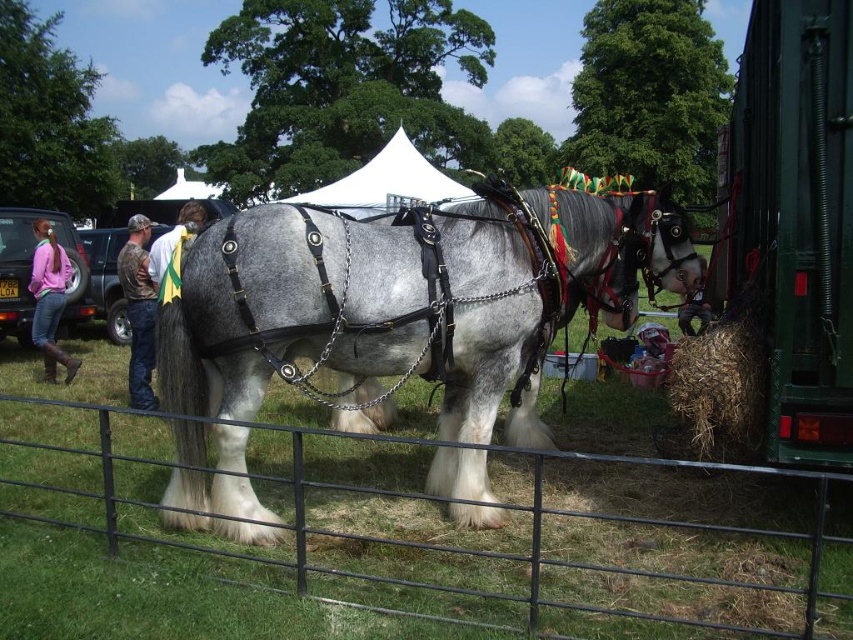
Question: Is gray shaggy horse at center closer to camera compared to white fabric canopy at upper center?

Choices:
 (A) yes
 (B) no

Answer: (A)

Question: Is metallic wire fence at center wider than gray shaggy horse at center?

Choices:
 (A) yes
 (B) no

Answer: (A)

Question: Which point is farther from the camera taking this photo?

Choices:
 (A) (198, 218)
 (B) (368, 330)
 (C) (425, 188)

Answer: (C)

Question: Does gray shaggy horse at center appear over white fabric canopy at upper center?

Choices:
 (A) yes
 (B) no

Answer: (B)

Question: Estimate the real-world distances between objects in this image. Which object is farther from the white fabric canopy at upper center?

Choices:
 (A) pink fleece jacket at left
 (B) brown leather jacket at left

Answer: (B)

Question: Which object appears farthest from the camera in this image?

Choices:
 (A) brown leather jacket at left
 (B) metallic wire fence at center
 (C) brown straw at lower right

Answer: (A)